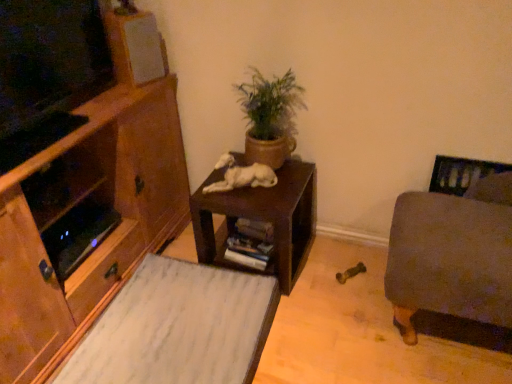
This screenshot has width=512, height=384. Find the location of `vacant space underneath velvet gray ottoman at right (from a real-world perspective)`. vacant space underneath velvet gray ottoman at right (from a real-world perspective) is located at coordinates (457, 337).